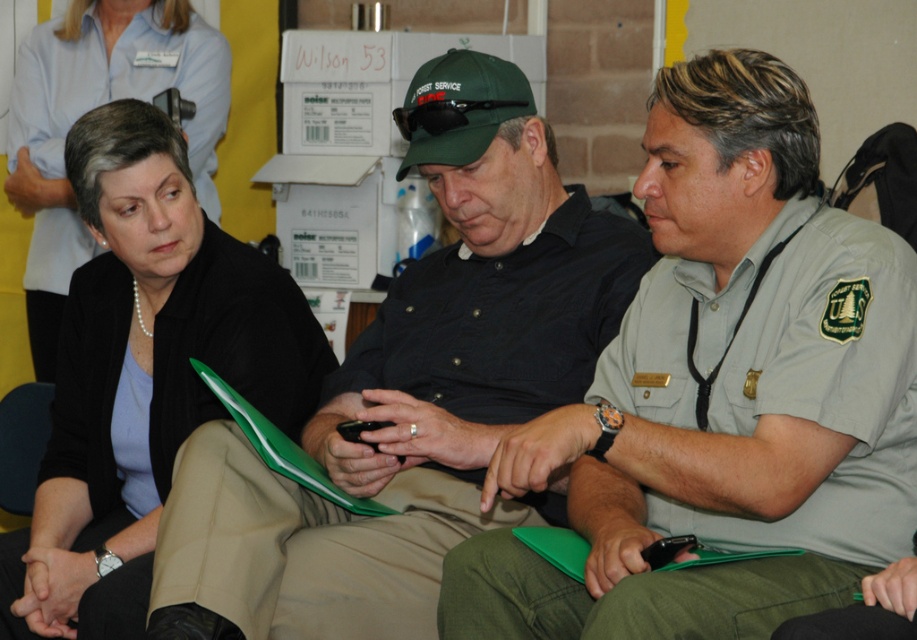
You are standing in the room and want to hand a document to the person wearing the green uniform shirt at center. Based on their position coordinates, where should you walk to find them?

The green uniform shirt at center is located at coordinates point (722, 392), so you should walk towards that position to find them.

You are an interior designer observing the scene. You need to place a decorative item between the matte black shirt at center and the pearl necklace at upper left. According to their positions, which object should be closer to the left side?

The pearl necklace at upper left is on the left side of the matte black shirt at center, so the decorative item should be placed closer to the pearl necklace at upper left.

You are standing in the room and want to place a 8 feet long table in the direction of point (573, 273). Is there enough space in front of that point to fit the table?

The distance of point (573, 273) from viewer is 7.49 feet. Since the table is 8 feet long, there is not enough space in front of that point to fit the table.